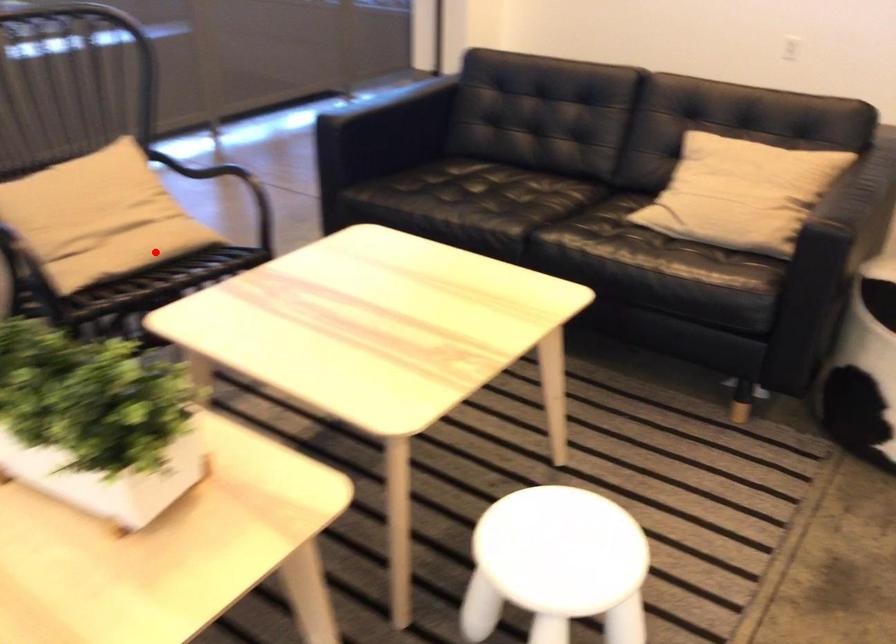
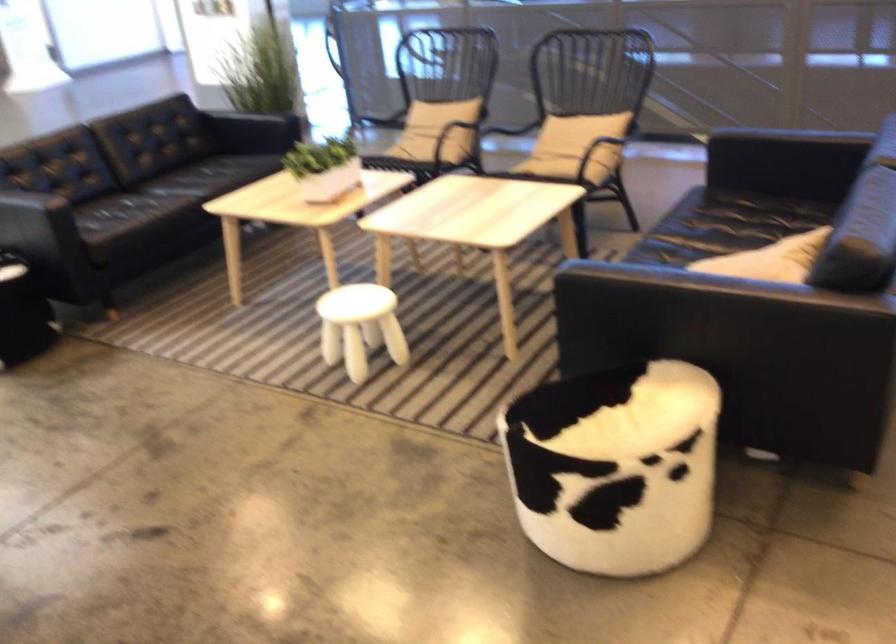
Question: I am providing you with two images of the same scene from different viewpoints. Given a red point in image1, look at the same physical point in image2. Is it:

Choices:
 (A) Closer to the viewpoint
 (B) Farther from the viewpoint

Answer: (B)